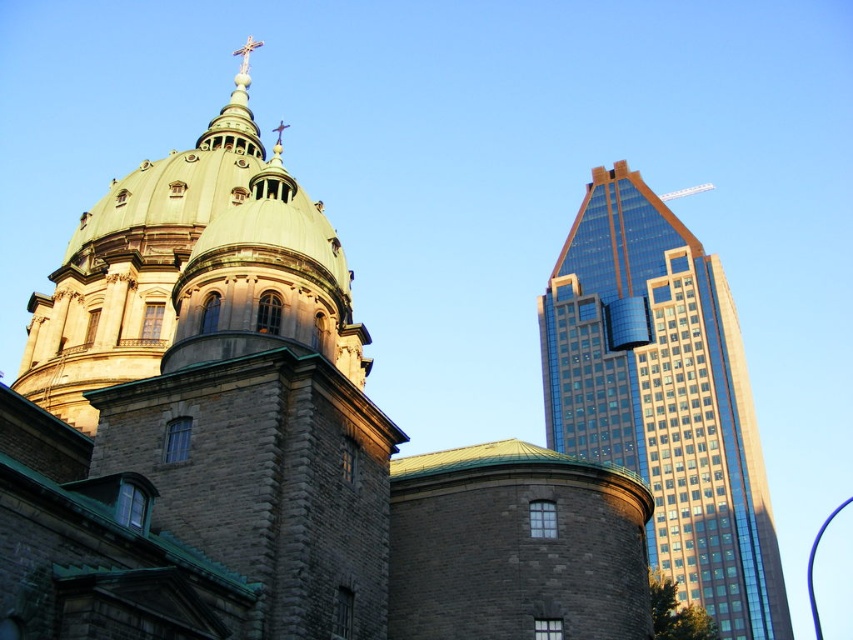
Who is taller, brown stone church at center or shiny glass skyscraper at right?

brown stone church at center is taller.

Is brown stone church at center positioned at the back of shiny glass skyscraper at right?

No, it is in front of shiny glass skyscraper at right.

This screenshot has width=853, height=640. Find the location of `brown stone church at center`. brown stone church at center is located at coordinates (268, 445).